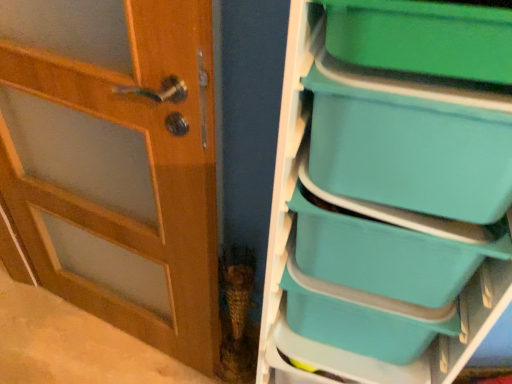
Question: From a real-world perspective, relative to teal plastic storage box at right, marked as the first storage box in a bottom-to-top arrangement, is teal plastic storage box at right, which ranks as the second storage box in bottom-to-top order, vertically above or below?

Choices:
 (A) below
 (B) above

Answer: (B)

Question: From their relative heights in the image, would you say teal plastic storage box at right, which ranks as the 3th storage box in top-to-bottom order, is taller or shorter than teal plastic storage box at right, which ranks as the 4th storage box in top-to-bottom order?

Choices:
 (A) tall
 (B) short

Answer: (B)

Question: Estimate the real-world distances between objects in this image. Which object is farther from the teal plastic storage box at upper right, placed as the third storage box when sorted from bottom to top?

Choices:
 (A) teal plastic storage box at right, marked as the first storage box in a bottom-to-top arrangement
 (B) wooden door at left
 (C) teal plastic storage box at right, which ranks as the 3th storage box in top-to-bottom order
 (D) green plastic storage box at upper right, the first storage box in the top-to-bottom sequence
 (E) teal plastic storage bins at right

Answer: (B)

Question: Estimate the real-world distances between objects in this image. Which object is closer to the teal plastic storage box at upper right, placed as the third storage box when sorted from bottom to top?

Choices:
 (A) teal plastic storage box at right, which ranks as the 4th storage box in top-to-bottom order
 (B) teal plastic storage bins at right
 (C) wooden door at left
 (D) green plastic storage box at upper right, the 4th storage box positioned from the bottom
 (E) teal plastic storage box at right, which ranks as the 3th storage box in top-to-bottom order

Answer: (B)